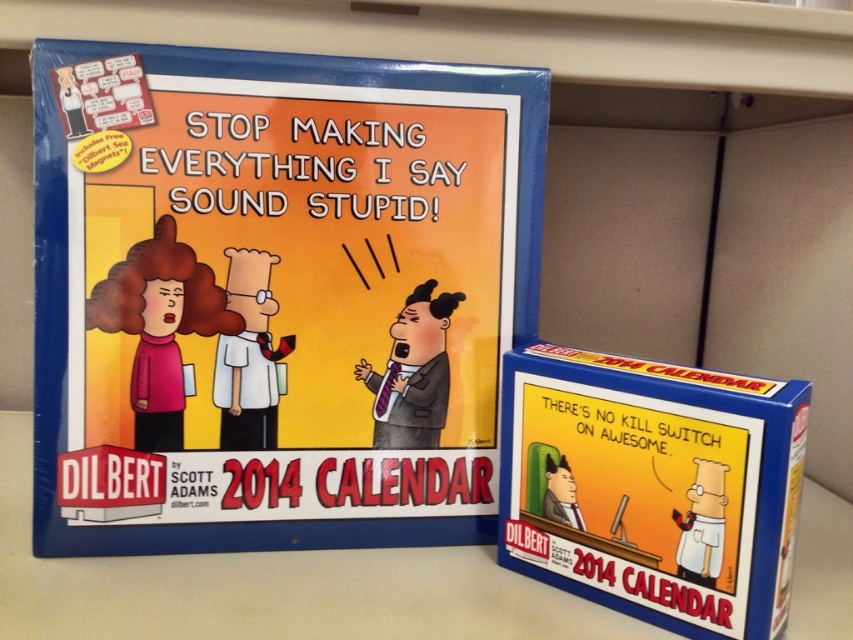
You are standing in front of a display featuring a matte blue calendar at upper left and a promotional item at lower right. The calendar has a vibrant cover with three characters. If you want to read the text on the calendar cover clearly, which object should you focus on and why?

You should focus on the matte blue calendar at upper left because it is closer to the camera at 24.23 inches, allowing for a clearer view of its text compared to the promotional item at lower right which is farther away.